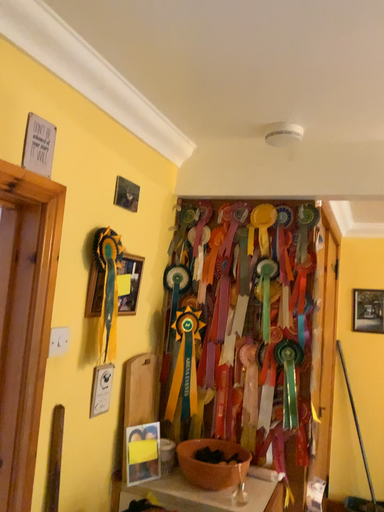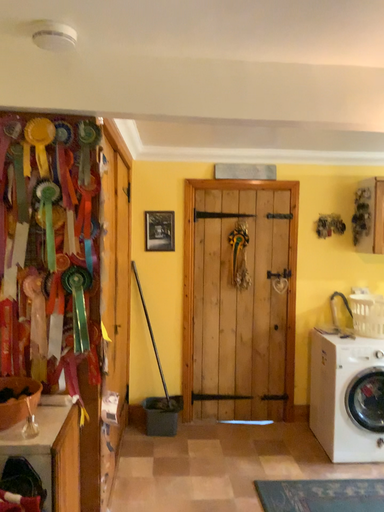
Question: How did the camera likely rotate when shooting the video?

Choices:
 (A) rotated downward
 (B) rotated upward

Answer: (A)